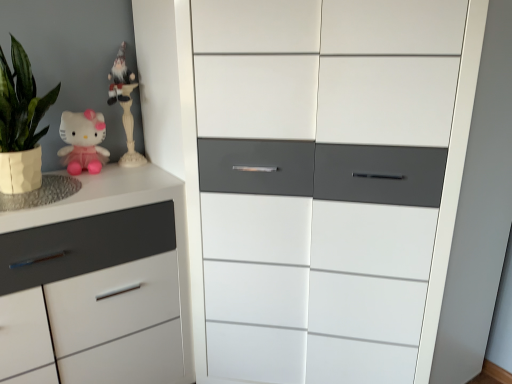
At what (x,y) coordinates should I click in order to perform the action: click on vacant area that is in front of white glossy gnome at upper left. Please return your answer as a coordinate pair (x, y). Looking at the image, I should click on (131, 170).